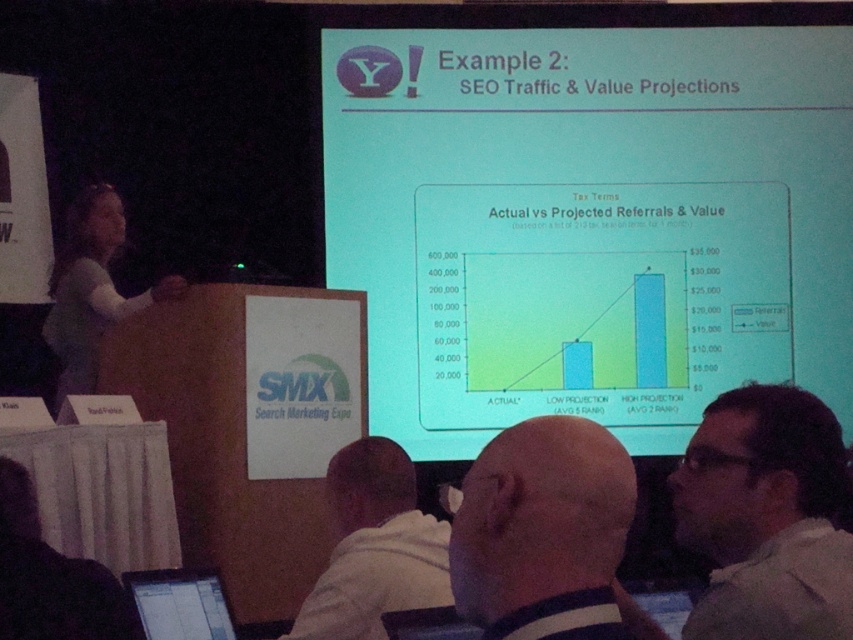
Question: Which of these objects is positioned closest to the bald head at center?

Choices:
 (A) green matte projector screen at upper center
 (B) dark brown hair at upper right

Answer: (B)

Question: Is dark brown hair at upper right to the left of bald head at center from the viewer's perspective?

Choices:
 (A) yes
 (B) no

Answer: (B)

Question: Does dark brown hair at upper right appear on the right side of white fabric shirt at lower center?

Choices:
 (A) yes
 (B) no

Answer: (A)

Question: Which point appears closest to the camera in this image?

Choices:
 (A) (762, 486)
 (B) (360, 76)
 (C) (317, 630)
 (D) (141, 579)

Answer: (A)

Question: Can you confirm if green matte projector screen at upper center is wider than white fabric shirt at lower center?

Choices:
 (A) no
 (B) yes

Answer: (B)

Question: Which point is farther to the camera?

Choices:
 (A) black glossy tablet at lower left
 (B) green matte projector screen at upper center
 (C) white fabric shirt at lower center

Answer: (B)